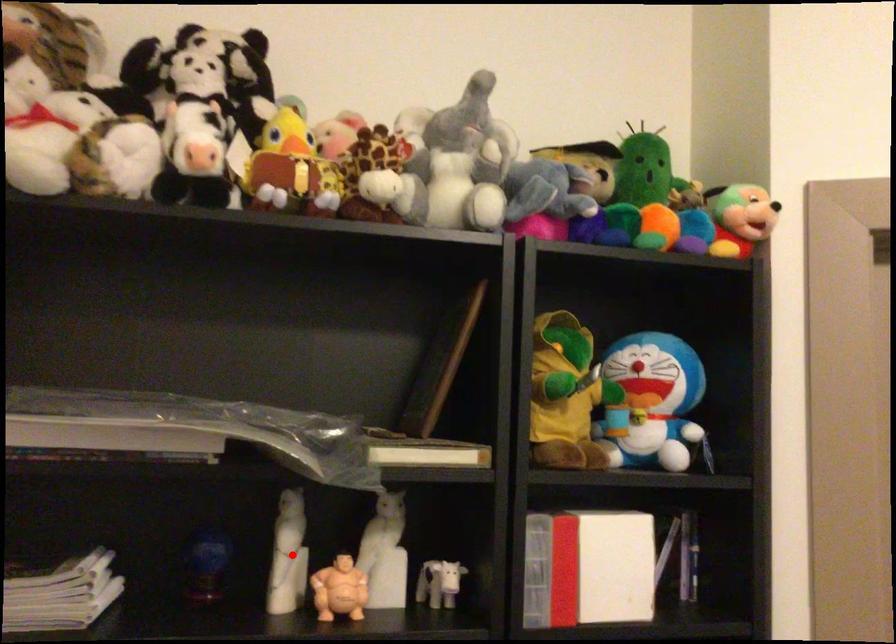
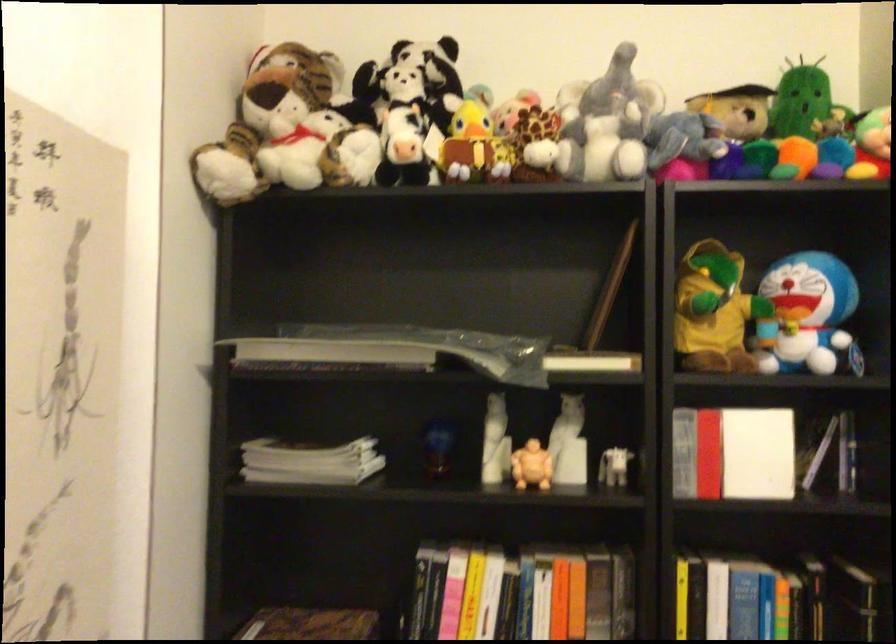
Question: A red point is marked in image1. In image2, is the corresponding 3D point closer to the camera or farther? Reply with the corresponding letter.

Choices:
 (A) The corresponding 3D point is closer.
 (B) The corresponding 3D point is farther.

Answer: (B)